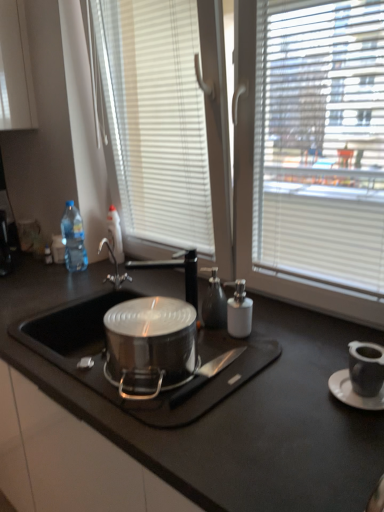
Question: From the image's perspective, is black matte tap at center below black matte countertop at center?

Choices:
 (A) no
 (B) yes

Answer: (A)

Question: Is black matte tap at center bigger than black matte countertop at center?

Choices:
 (A) no
 (B) yes

Answer: (A)

Question: Considering the relative sizes of black matte tap at center and black matte countertop at center in the image provided, is black matte tap at center thinner than black matte countertop at center?

Choices:
 (A) no
 (B) yes

Answer: (B)

Question: Considering the relative sizes of black matte tap at center and black matte countertop at center in the image provided, is black matte tap at center wider than black matte countertop at center?

Choices:
 (A) no
 (B) yes

Answer: (A)

Question: Does black matte tap at center appear on the left side of black matte countertop at center?

Choices:
 (A) yes
 (B) no

Answer: (A)

Question: From a real-world perspective, is black matte knife at center positioned above or below translucent plastic bottle at upper left, which is the 2th bottle in left-to-right order?

Choices:
 (A) above
 (B) below

Answer: (B)

Question: In terms of height, does black matte knife at center look taller or shorter compared to translucent plastic bottle at upper left, positioned as the 1th bottle in right-to-left order?

Choices:
 (A) tall
 (B) short

Answer: (B)

Question: Considering the relative positions of black matte knife at center and translucent plastic bottle at upper left, positioned as the 1th bottle in right-to-left order, in the image provided, is black matte knife at center to the left or to the right of translucent plastic bottle at upper left, positioned as the 1th bottle in right-to-left order,?

Choices:
 (A) left
 (B) right

Answer: (B)

Question: Choose the correct answer: Is black matte knife at center inside translucent plastic bottle at upper left, positioned as the 1th bottle in right-to-left order, or outside it?

Choices:
 (A) inside
 (B) outside

Answer: (B)

Question: Is white ceramic saucer at lower right taller or shorter than translucent plastic bottle at upper left, positioned as the 1th bottle in right-to-left order?

Choices:
 (A) tall
 (B) short

Answer: (B)

Question: From a real-world perspective, is white ceramic saucer at lower right positioned above or below translucent plastic bottle at upper left, positioned as the 1th bottle in right-to-left order?

Choices:
 (A) below
 (B) above

Answer: (A)

Question: Is white ceramic saucer at lower right bigger or smaller than translucent plastic bottle at upper left, which is the 2th bottle in left-to-right order?

Choices:
 (A) small
 (B) big

Answer: (A)

Question: Would you say white ceramic saucer at lower right is to the left or to the right of translucent plastic bottle at upper left, positioned as the 1th bottle in right-to-left order, in the picture?

Choices:
 (A) left
 (B) right

Answer: (B)

Question: Is black matte knife at center taller or shorter than white ceramic saucer at lower right?

Choices:
 (A) short
 (B) tall

Answer: (B)

Question: Considering their positions, is black matte knife at center located in front of or behind white ceramic saucer at lower right?

Choices:
 (A) front
 (B) behind

Answer: (B)